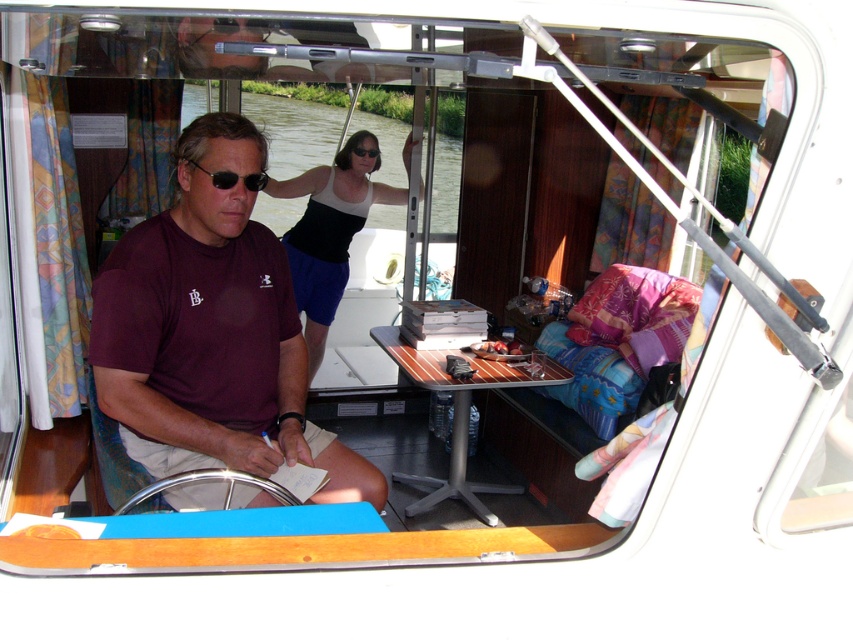
Question: Is maroon t-shirt at center below matte black sunglasses at upper center?

Choices:
 (A) yes
 (B) no

Answer: (A)

Question: Is maroon t-shirt at center above matte black sunglasses at upper center?

Choices:
 (A) yes
 (B) no

Answer: (B)

Question: Among these points, which one is nearest to the camera?

Choices:
 (A) (251, 179)
 (B) (372, 148)

Answer: (A)

Question: Which of the following is the closest to the observer?

Choices:
 (A) black matte sunglasses at left
 (B) matte black sunglasses at upper center
 (C) maroon t-shirt at center

Answer: (A)

Question: Which of the following is the farthest from the observer?

Choices:
 (A) black matte sunglasses at left
 (B) maroon t-shirt at center

Answer: (B)

Question: Where is maroon t-shirt at center located in relation to black matte sunglasses at left in the image?

Choices:
 (A) left
 (B) right

Answer: (A)